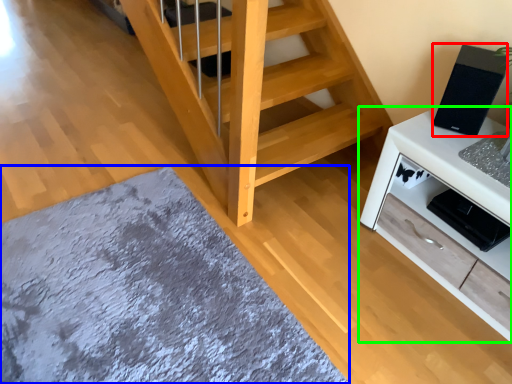
Question: Based on their relative distances, which object is farther from appliance (highlighted by a red box)? Choose from mat (highlighted by a blue box) and cabinetry (highlighted by a green box).

Choices:
 (A) mat
 (B) cabinetry

Answer: (A)